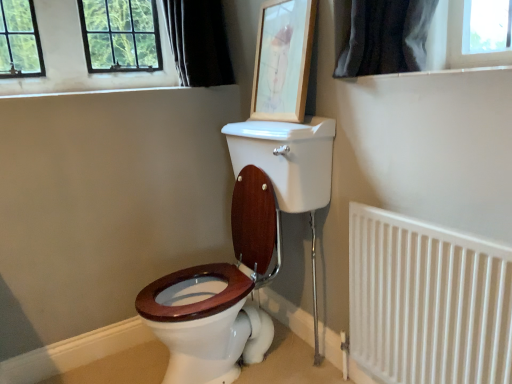
Question: Considering the relative sizes of wooden picture frame at upper center and black fabric curtain at upper left in the image provided, is wooden picture frame at upper center taller than black fabric curtain at upper left?

Choices:
 (A) no
 (B) yes

Answer: (B)

Question: Considering the relative positions of wooden picture frame at upper center and black fabric curtain at upper left in the image provided, is wooden picture frame at upper center to the left of black fabric curtain at upper left from the viewer's perspective?

Choices:
 (A) no
 (B) yes

Answer: (A)

Question: Can black fabric curtain at upper left be found inside wooden picture frame at upper center?

Choices:
 (A) no
 (B) yes

Answer: (A)

Question: From the image's perspective, is wooden picture frame at upper center located above black fabric curtain at upper left?

Choices:
 (A) no
 (B) yes

Answer: (A)

Question: Considering the relative positions of wooden picture frame at upper center and black fabric curtain at upper left in the image provided, is wooden picture frame at upper center to the right of black fabric curtain at upper left from the viewer's perspective?

Choices:
 (A) yes
 (B) no

Answer: (A)

Question: Considering the relative sizes of wooden picture frame at upper center and black fabric curtain at upper left in the image provided, is wooden picture frame at upper center shorter than black fabric curtain at upper left?

Choices:
 (A) no
 (B) yes

Answer: (A)

Question: Does black fabric curtain at upper left have a smaller size compared to white metal radiator at lower right?

Choices:
 (A) no
 (B) yes

Answer: (A)

Question: Could white metal radiator at lower right be considered to be inside black fabric curtain at upper left?

Choices:
 (A) yes
 (B) no

Answer: (B)

Question: Does black fabric curtain at upper left lie in front of white metal radiator at lower right?

Choices:
 (A) yes
 (B) no

Answer: (B)

Question: Can you confirm if black fabric curtain at upper left is thinner than white metal radiator at lower right?

Choices:
 (A) no
 (B) yes

Answer: (A)

Question: Can you confirm if black fabric curtain at upper left is shorter than white metal radiator at lower right?

Choices:
 (A) yes
 (B) no

Answer: (A)

Question: Considering the relative positions of black fabric curtain at upper left and white metal radiator at lower right in the image provided, is black fabric curtain at upper left to the right of white metal radiator at lower right from the viewer's perspective?

Choices:
 (A) no
 (B) yes

Answer: (A)

Question: Is white metal radiator at lower right taller than black fabric curtain at upper left?

Choices:
 (A) no
 (B) yes

Answer: (B)